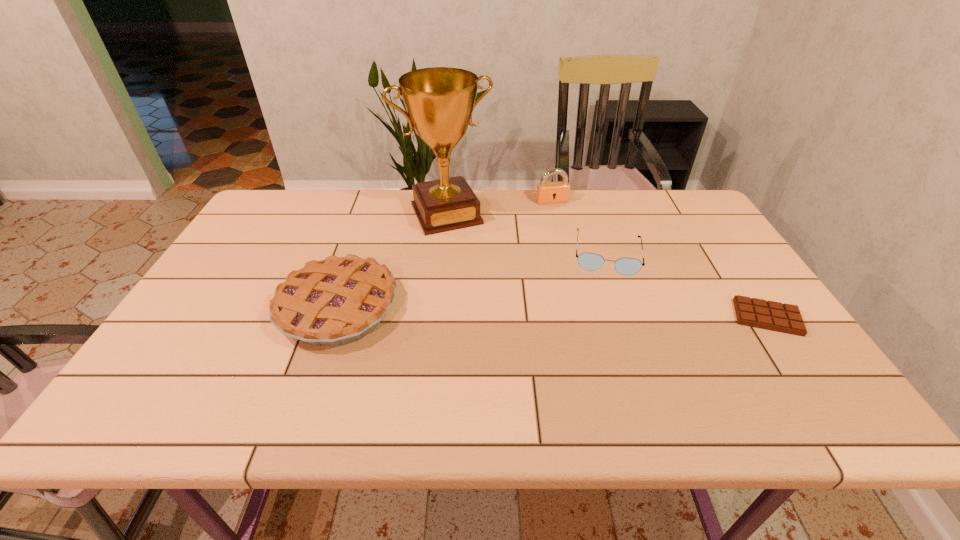
You are a GUI agent. You are given a task and a screenshot of the screen. Output one action in this format:
    pyautogui.click(x=<x>, y=<y>)
    Task: Click on the vacant area in the image that satisfies the following two spatial constraints: 1. on the back side of the tallest object; 2. on the right side of the pie
    This screenshot has height=540, width=960.
    Given the screenshot: What is the action you would take?
    click(x=371, y=214)